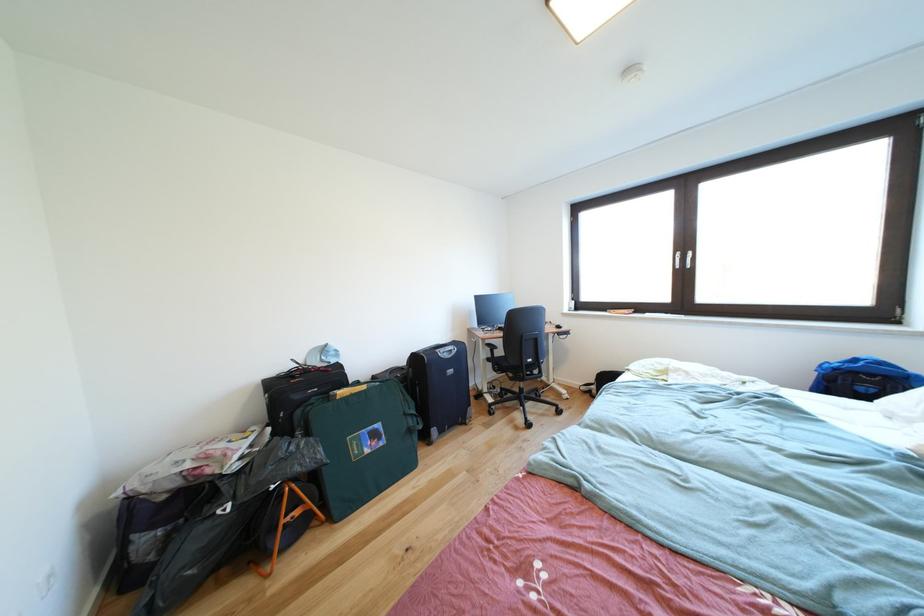
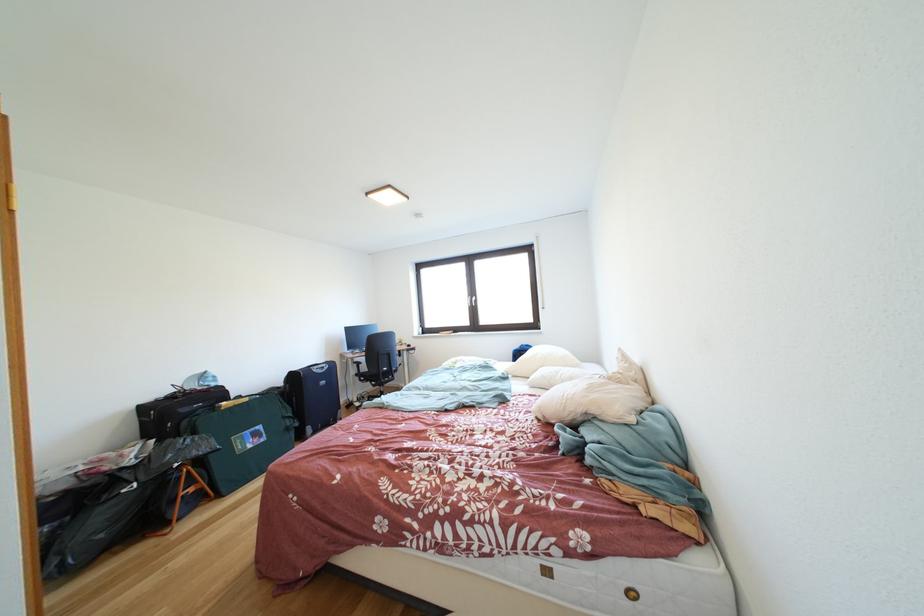
The point at (519, 384) is marked in the first image. Where is the corresponding point in the second image?

(383, 391)